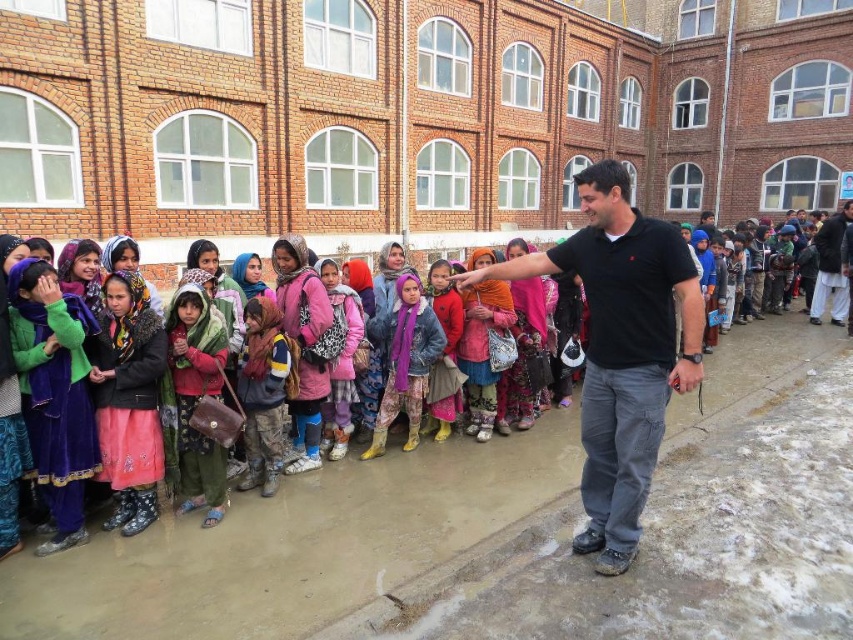
Question: Which point appears farthest from the camera in this image?

Choices:
 (A) (608, 448)
 (B) (410, 369)
 (C) (184, 332)
 (D) (264, 440)

Answer: (B)

Question: Which of the following is the closest to the observer?

Choices:
 (A) multicolored fabric dress at center
 (B) purple wool scarf at center
 (C) green fabric scarf at left

Answer: (C)

Question: Can you confirm if multicolored knitted scarf at center is positioned below dark brown woolen suit at right?

Choices:
 (A) no
 (B) yes

Answer: (B)

Question: Is black cotton shirt at center positioned at the back of pink fabric scarf at center?

Choices:
 (A) no
 (B) yes

Answer: (A)

Question: Can you confirm if floral fabric dress at center is positioned to the right of multicolored fabric dress at center?

Choices:
 (A) no
 (B) yes

Answer: (B)

Question: Which object is farther from the camera taking this photo?

Choices:
 (A) green fabric scarf at left
 (B) purple wool scarf at center

Answer: (B)